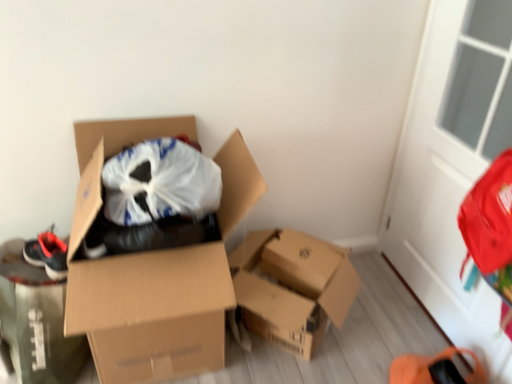
This screenshot has width=512, height=384. In order to click on matte black shoe at left in this screenshot , I will do `click(36, 321)`.

The image size is (512, 384). What do you see at coordinates (452, 168) in the screenshot? I see `white glass screen door at upper right` at bounding box center [452, 168].

Locate an element on the screen. matte black shoe at left is located at coordinates (x=36, y=321).

Locate an element on the screen. This screenshot has height=384, width=512. screen door in front of the cardboard box at center, which ranks as the second box in left-to-right order is located at coordinates (452, 168).

In terms of size, does white glass screen door at upper right appear bigger or smaller than cardboard box at center, which ranks as the second box in left-to-right order?

Considering their sizes, white glass screen door at upper right takes up less space than cardboard box at center, which ranks as the second box in left-to-right order.

Is white glass screen door at upper right touching cardboard box at center, acting as the first box starting from the right?

white glass screen door at upper right and cardboard box at center, acting as the first box starting from the right, are not in contact.

Between white glass screen door at upper right and cardboard box at center, which ranks as the second box in left-to-right order, which one is positioned behind?

cardboard box at center, which ranks as the second box in left-to-right order, is behind.

Is matte black shoe at left aimed at white glass screen door at upper right?

No, matte black shoe at left is not facing towards white glass screen door at upper right.

From the image's perspective, does matte black shoe at left appear lower than white glass screen door at upper right?

Correct, matte black shoe at left appears lower than white glass screen door at upper right in the image.

At what (x,y) coordinates should I click in order to perform the action: click on cardboard box on the left of white glass screen door at upper right. Please return your answer as a coordinate pair (x, y). The height and width of the screenshot is (384, 512). Looking at the image, I should click on coord(36,321).

Is white glass screen door at upper right inside matte black shoe at left?

Actually, white glass screen door at upper right is outside matte black shoe at left.

What's the angular difference between white glass screen door at upper right and matte black shoe at left's facing directions?

There is a 89.2-degree angle between the facing directions of white glass screen door at upper right and matte black shoe at left.

Consider the image. Does white glass screen door at upper right have a greater width compared to matte black shoe at left?

No.

Are white glass screen door at upper right and matte black shoe at left making contact?

No, white glass screen door at upper right is not making contact with matte black shoe at left.

Where is `cardboard box below the white glass screen door at upper right (from the image's perspective)`? Image resolution: width=512 pixels, height=384 pixels. cardboard box below the white glass screen door at upper right (from the image's perspective) is located at coordinates (36, 321).

Is cardboard box at center, which ranks as the second box in left-to-right order, taller than cardboard box at center, the second box from the right?

No, cardboard box at center, which ranks as the second box in left-to-right order, is not taller than cardboard box at center, the second box from the right.

Is cardboard box at center, which ranks as the second box in left-to-right order, not near cardboard box at center, the second box from the right?

No.

Looking at this image, from a real-world perspective, which is physically above, cardboard box at center, which ranks as the second box in left-to-right order, or cardboard box at center, the first box positioned from the left?

cardboard box at center, the first box positioned from the left, from a real-world perspective.

Considering the relative positions of cardboard box at center, acting as the first box starting from the right, and cardboard box at center, the first box positioned from the left, in the image provided, is cardboard box at center, acting as the first box starting from the right, in front of cardboard box at center, the first box positioned from the left,?

No, the depth of cardboard box at center, acting as the first box starting from the right, is greater than that of cardboard box at center, the first box positioned from the left.

Is cardboard box at center, which ranks as the second box in left-to-right order, to the left of white glass screen door at upper right from the viewer's perspective?

Yes.

Locate an element on the screen. The image size is (512, 384). the 2nd box below when counting from the white glass screen door at upper right (from the image's perspective) is located at coordinates (292, 287).

Does cardboard box at center, acting as the first box starting from the right, turn towards white glass screen door at upper right?

No, cardboard box at center, acting as the first box starting from the right, is not oriented towards white glass screen door at upper right.

Looking at this image, from a real-world perspective, which object rests below the other?

From a 3D spatial view, cardboard box at center, acting as the first box starting from the right, is below.

Where is `cardboard box that appears below the cardboard box at center, the first box positioned from the left (from a real-world perspective)`? The height and width of the screenshot is (384, 512). cardboard box that appears below the cardboard box at center, the first box positioned from the left (from a real-world perspective) is located at coordinates (36, 321).

From the image's perspective, between cardboard box at center, the first box positioned from the left, and matte black shoe at left, which one is located above?

cardboard box at center, the first box positioned from the left, appears higher in the image.

Between cardboard box at center, the second box from the right, and matte black shoe at left, which one has smaller size?

With smaller size is matte black shoe at left.

Considering the relative sizes of cardboard box at center, the second box from the right, and matte black shoe at left in the image provided, is cardboard box at center, the second box from the right, shorter than matte black shoe at left?

No, cardboard box at center, the second box from the right, is not shorter than matte black shoe at left.

Is matte black shoe at left wider than cardboard box at center, the first box positioned from the left?

Incorrect, the width of matte black shoe at left does not surpass that of cardboard box at center, the first box positioned from the left.

Which is nearer, (49,331) or (160,355)?

Clearly, point (49,331) is closer to the camera than point (160,355).

Does matte black shoe at left appear on the left side of cardboard box at center, the second box from the right?

Indeed, matte black shoe at left is positioned on the left side of cardboard box at center, the second box from the right.

Is matte black shoe at left far away from cardboard box at center, the second box from the right?

matte black shoe at left is near cardboard box at center, the second box from the right, not far away.

Identify the location of box that is the 2nd one when counting downward from the white glass screen door at upper right (from the image's perspective). This screenshot has height=384, width=512. (292, 287).

The image size is (512, 384). In order to click on screen door located above the matte black shoe at left (from the image's perspective) in this screenshot , I will do `click(452, 168)`.

Looking at the image, which one is located closer to cardboard box at center, acting as the first box starting from the right, cardboard box at center, the second box from the right, or white glass screen door at upper right?

Based on the image, cardboard box at center, the second box from the right, appears to be nearer to cardboard box at center, acting as the first box starting from the right.

From the picture: Which object lies further to the anchor point white glass screen door at upper right, cardboard box at center, acting as the first box starting from the right, or matte black shoe at left?

Based on the image, matte black shoe at left appears to be further to white glass screen door at upper right.

Based on their spatial positions, is matte black shoe at left or cardboard box at center, acting as the first box starting from the right, closer to cardboard box at center, the first box positioned from the left?

matte black shoe at left is positioned closer to the anchor cardboard box at center, the first box positioned from the left.

Consider the image. Estimate the real-world distances between objects in this image. Which object is closer to matte black shoe at left, white glass screen door at upper right or cardboard box at center, which ranks as the second box in left-to-right order?

Based on the image, cardboard box at center, which ranks as the second box in left-to-right order, appears to be nearer to matte black shoe at left.

Considering their positions, is matte black shoe at left positioned further to cardboard box at center, the first box positioned from the left, than white glass screen door at upper right?

white glass screen door at upper right is positioned further to the anchor cardboard box at center, the first box positioned from the left.

Considering their positions, is white glass screen door at upper right positioned closer to cardboard box at center, which ranks as the second box in left-to-right order, than cardboard box at center, the first box positioned from the left?

cardboard box at center, the first box positioned from the left, lies closer to cardboard box at center, which ranks as the second box in left-to-right order, than the other object.

When comparing their distances from cardboard box at center, the first box positioned from the left, does white glass screen door at upper right or matte black shoe at left seem further?

white glass screen door at upper right.

Based on their spatial positions, is cardboard box at center, acting as the first box starting from the right, or white glass screen door at upper right further from cardboard box at center, the second box from the right?

Among the two, white glass screen door at upper right is located further to cardboard box at center, the second box from the right.

Identify the location of box between cardboard box at center, the second box from the right, and white glass screen door at upper right from left to right. (292, 287).

You are a GUI agent. You are given a task and a screenshot of the screen. Output one action in this format:
    pyautogui.click(x=<x>, y=<y>)
    Task: Click on the box between matte black shoe at left and cardboard box at center, acting as the first box starting from the right, from left to right
    Image resolution: width=512 pixels, height=384 pixels.
    Given the screenshot: What is the action you would take?
    pyautogui.click(x=143, y=280)